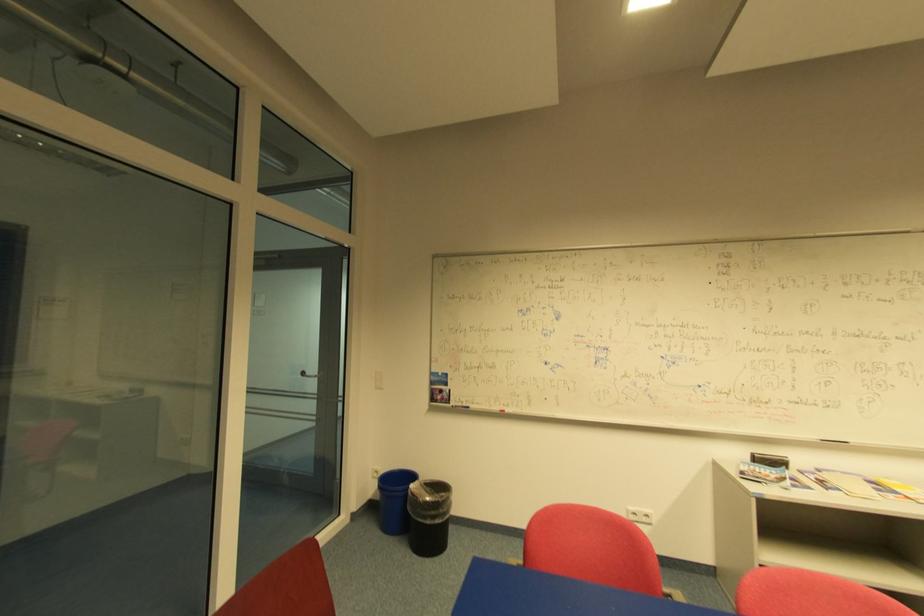
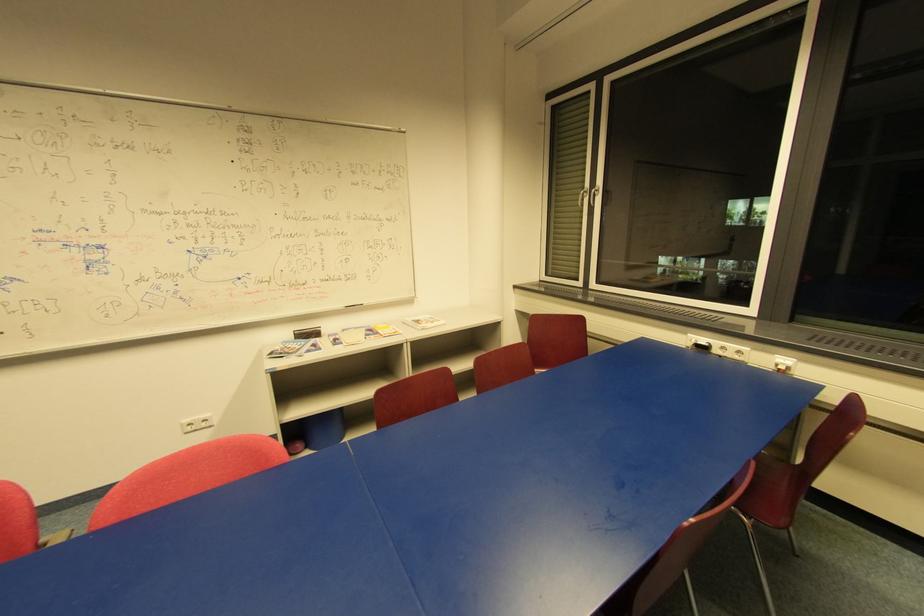
Locate, in the second image, the point that corresponds to (x=816, y=438) in the first image.

(344, 307)